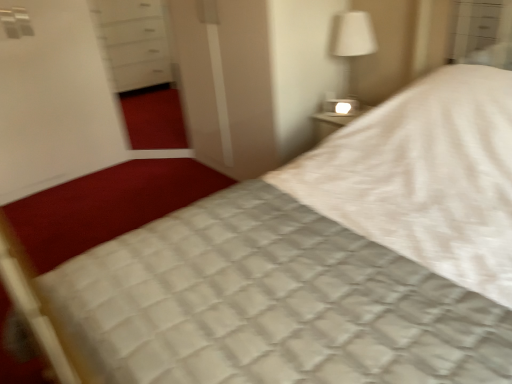
Question: Are white glossy screen door at upper left, the 1th screen door from the left, and transparent glass screen door at center, the 2th screen door from the left, far apart?

Choices:
 (A) yes
 (B) no

Answer: (B)

Question: Would you say white glossy screen door at upper left, marked as the 2th screen door in a right-to-left arrangement, is outside transparent glass screen door at center, the 2th screen door from the left?

Choices:
 (A) yes
 (B) no

Answer: (A)

Question: Is white glossy screen door at upper left, the 1th screen door from the left, in front of transparent glass screen door at center, which is the first screen door in right-to-left order?

Choices:
 (A) yes
 (B) no

Answer: (B)

Question: From the image's perspective, would you say white glossy screen door at upper left, marked as the 2th screen door in a right-to-left arrangement, is shown under transparent glass screen door at center, which is the first screen door in right-to-left order?

Choices:
 (A) yes
 (B) no

Answer: (A)

Question: Is white glossy screen door at upper left, marked as the 2th screen door in a right-to-left arrangement, further to camera compared to transparent glass screen door at center, the 2th screen door from the left?

Choices:
 (A) yes
 (B) no

Answer: (A)

Question: Is transparent glass screen door at center, the 2th screen door from the left, in front of or behind white fabric lampshade at upper right in the image?

Choices:
 (A) behind
 (B) front

Answer: (B)

Question: From the image's perspective, is transparent glass screen door at center, the 2th screen door from the left, located above or below white fabric lampshade at upper right?

Choices:
 (A) above
 (B) below

Answer: (B)

Question: Is transparent glass screen door at center, the 2th screen door from the left, bigger or smaller than white fabric lampshade at upper right?

Choices:
 (A) big
 (B) small

Answer: (A)

Question: Is point (202, 82) closer or farther from the camera than point (357, 23)?

Choices:
 (A) closer
 (B) farther

Answer: (B)

Question: Looking at the image, does white fabric lampshade at upper right seem bigger or smaller compared to transparent glass screen door at center, which is the first screen door in right-to-left order?

Choices:
 (A) big
 (B) small

Answer: (B)

Question: Visually, is white fabric lampshade at upper right positioned to the left or to the right of transparent glass screen door at center, which is the first screen door in right-to-left order?

Choices:
 (A) left
 (B) right

Answer: (B)

Question: From their relative heights in the image, would you say white fabric lampshade at upper right is taller or shorter than transparent glass screen door at center, which is the first screen door in right-to-left order?

Choices:
 (A) short
 (B) tall

Answer: (A)

Question: From the image's perspective, relative to transparent glass screen door at center, which is the first screen door in right-to-left order, is white fabric lampshade at upper right above or below?

Choices:
 (A) below
 (B) above

Answer: (B)

Question: Would you say transparent glass screen door at center, the 2th screen door from the left, is to the left or to the right of white glossy screen door at upper left, marked as the 2th screen door in a right-to-left arrangement, in the picture?

Choices:
 (A) right
 (B) left

Answer: (A)

Question: In terms of width, does transparent glass screen door at center, which is the first screen door in right-to-left order, look wider or thinner when compared to white glossy screen door at upper left, the 1th screen door from the left?

Choices:
 (A) wide
 (B) thin

Answer: (A)